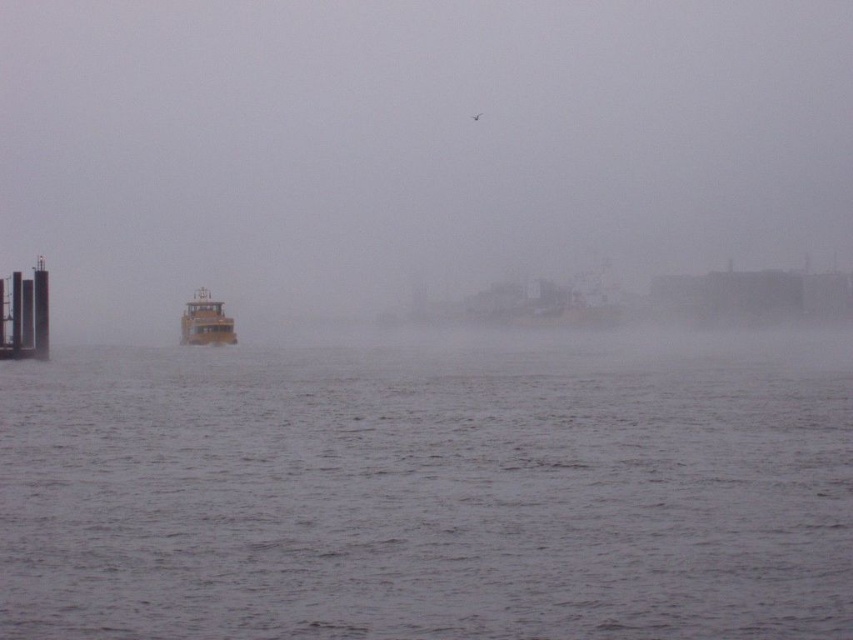
Based on the photo, you are standing at the point labeled point (x=662, y=474) and want to walk towards the point labeled point (x=15, y=332). Given the foggy conditions, which direction should you head to reach your destination?

Since point (x=662, y=474) is closer to the camera than point (x=15, y=332), you should head towards the lower part of the image to reach point (x=15, y=332).

You are a sailor navigating a narrow channel and see the foggy atmosphere at left and the yellow matte boat at center. Which object takes up more space in your view? Please consider their sizes as seen from your perspective.

The foggy atmosphere at left is larger in size than the yellow matte boat at center, so the foggy atmosphere at left takes up more space in your view.

You are a sailor navigating a boat and you see the foggy atmosphere at left and the gray matte water at center. Which one is located to the right side of the other?

The foggy atmosphere at left is positioned on the right side of gray matte water at center, so the foggy atmosphere at left is to the right of the gray matte water at center.